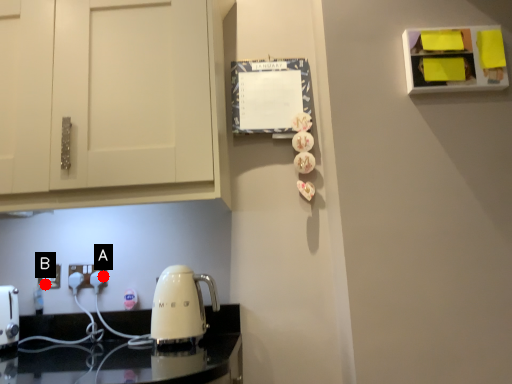
Question: Two points are circled on the image, labeled by A and B beside each circle. Which point is further to the camera?

Choices:
 (A) A is further
 (B) B is further

Answer: (B)